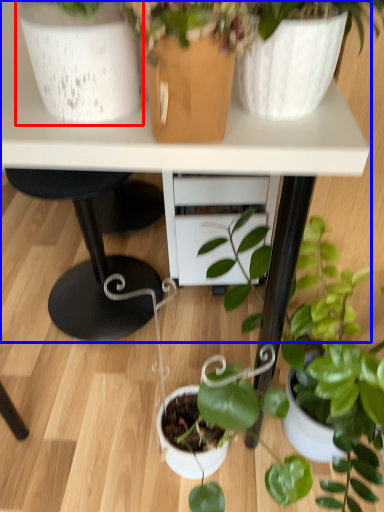
Question: Which object is further to the camera taking this photo, flowerpot (highlighted by a red box) or table (highlighted by a blue box)?

Choices:
 (A) flowerpot
 (B) table

Answer: (B)